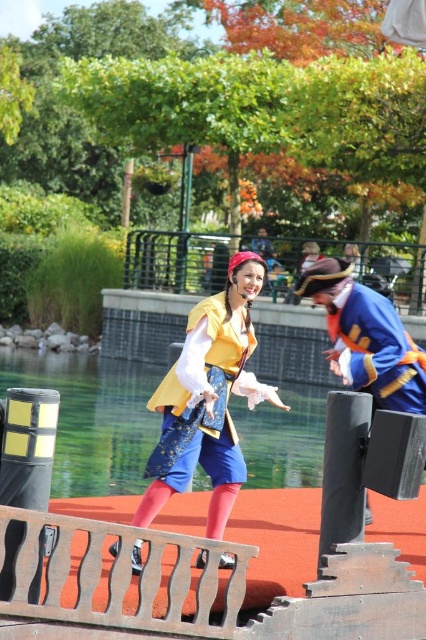
Is point (273, 460) closer to camera compared to point (166, 392)?

No, it is not.

Where is `transparent blue water at center`? The width and height of the screenshot is (426, 640). transparent blue water at center is located at coordinates (92, 417).

The image size is (426, 640). Find the location of `transparent blue water at center`. transparent blue water at center is located at coordinates (92, 417).

Who is more distant from viewer, (195, 452) or (382, 387)?

The point (382, 387) is more distant.

Is point (160, 476) in front of point (385, 340)?

Yes, it is.

Locate an element on the screen. The height and width of the screenshot is (640, 426). matte yellow vest at center is located at coordinates [207, 397].

Does transparent blue water at center appear on the left side of matte yellow vest at center?

Yes, transparent blue water at center is to the left of matte yellow vest at center.

Describe the element at coordinates (92, 417) in the screenshot. I see `transparent blue water at center` at that location.

Locate an element on the screen. The width and height of the screenshot is (426, 640). transparent blue water at center is located at coordinates (92, 417).